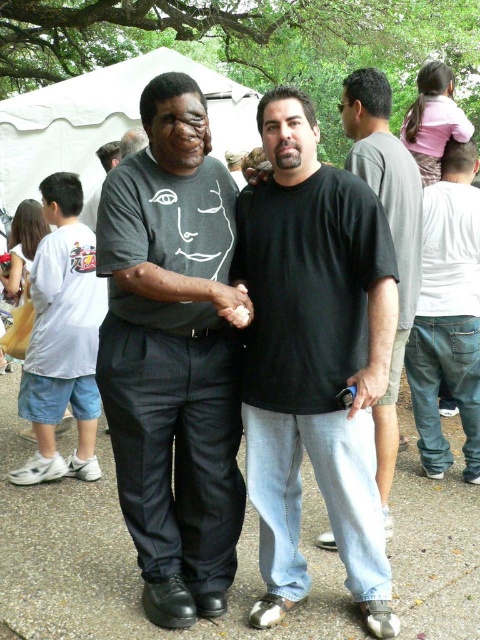
Question: In this image, where is white fabric tent at upper center located relative to jeans at right?

Choices:
 (A) below
 (B) above

Answer: (B)

Question: Among these points, which one is farthest from the camera?

Choices:
 (A) 243,108
 (B) 448,291

Answer: (A)

Question: Based on their relative distances, which object is nearer to the white fabric tent at upper center?

Choices:
 (A) black matte shirt at center
 (B) black cotton shirt at center

Answer: (B)

Question: Does gray concrete pavement at center lie in front of jeans at right?

Choices:
 (A) yes
 (B) no

Answer: (A)

Question: Based on their relative distances, which object is nearer to the black matte shirt at center?

Choices:
 (A) gray concrete pavement at center
 (B) white fabric tent at upper center

Answer: (A)

Question: Can you confirm if black matte shirt at center is thinner than black cotton shirt at center?

Choices:
 (A) yes
 (B) no

Answer: (B)